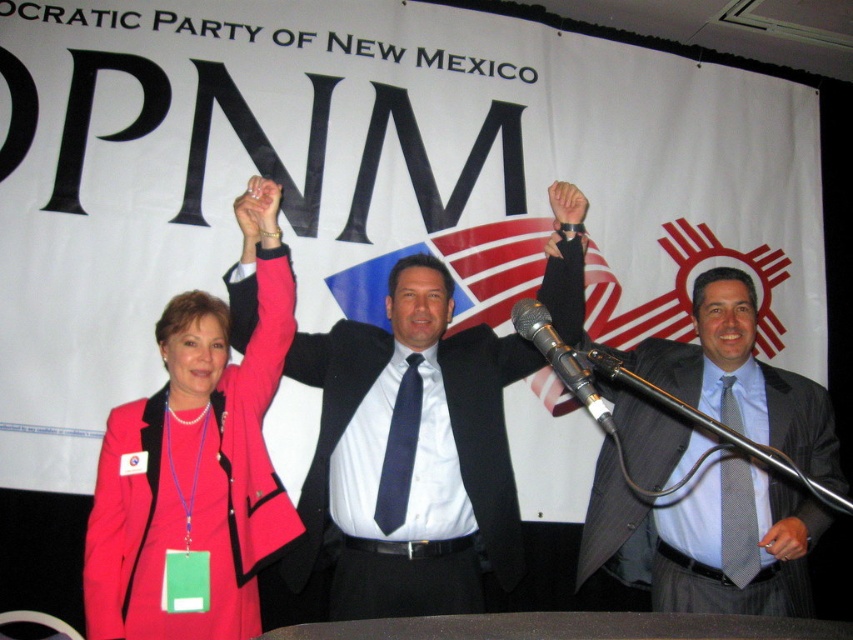
Which is behind, point (339, 358) or point (809, 534)?

The point (339, 358) is more distant.

Which is above, matte black suit at center or gray pinstripe suit at center?

matte black suit at center is above.

Find the location of `matte black suit at center`. matte black suit at center is located at coordinates (412, 451).

Is point (189, 291) farther from camera compared to point (654, 484)?

Yes, it is.

Between point (254, 372) and point (769, 388), which one is positioned in front?

Positioned in front is point (254, 372).

Is point (131, 445) behind point (630, 442)?

No.

This screenshot has height=640, width=853. In order to click on matte pink blazer at left in this screenshot , I will do `click(195, 470)`.

Which is behind, point (341, 364) or point (241, 444)?

Point (341, 364)

Is matte black suit at center shorter than matte pink blazer at left?

Correct, matte black suit at center is not as tall as matte pink blazer at left.

Who is more forward, (474, 516) or (86, 540)?

Positioned in front is point (86, 540).

You are a GUI agent. You are given a task and a screenshot of the screen. Output one action in this format:
    pyautogui.click(x=<x>, y=<y>)
    Task: Click on the matte black suit at center
    The height and width of the screenshot is (640, 853).
    Given the screenshot: What is the action you would take?
    pyautogui.click(x=412, y=451)